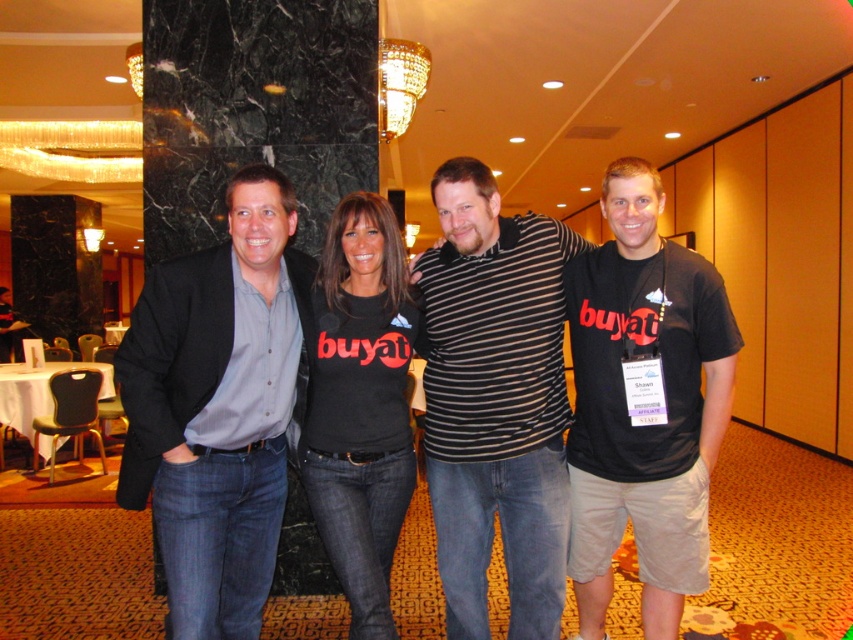
You are a photographer trying to decide which clothing item to focus on for a closeup shot. The matte gray blazer at center and the striped cotton shirt at center are both in the frame. Based on their positions, which one would you choose to ensure it appears larger in the photo?

The striped cotton shirt at center is taller than the matte gray blazer at center, so focusing on the striped cotton shirt at center would make it appear larger in the photo.